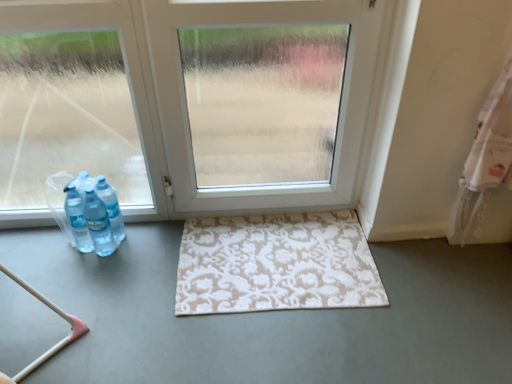
The height and width of the screenshot is (384, 512). Find the location of `vacant area that lies in front of beige patterned rug at center`. vacant area that lies in front of beige patterned rug at center is located at coordinates (283, 345).